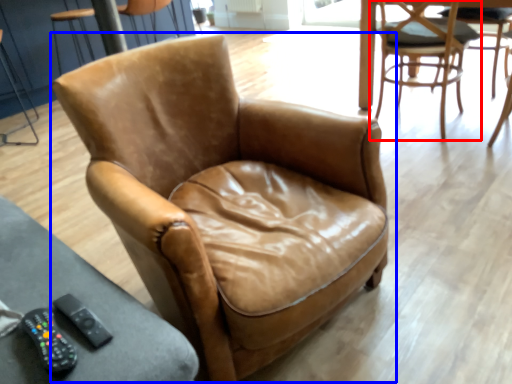
Question: Among these objects, which one is farthest to the camera, chair (highlighted by a red box) or chair (highlighted by a blue box)?

Choices:
 (A) chair
 (B) chair

Answer: (A)